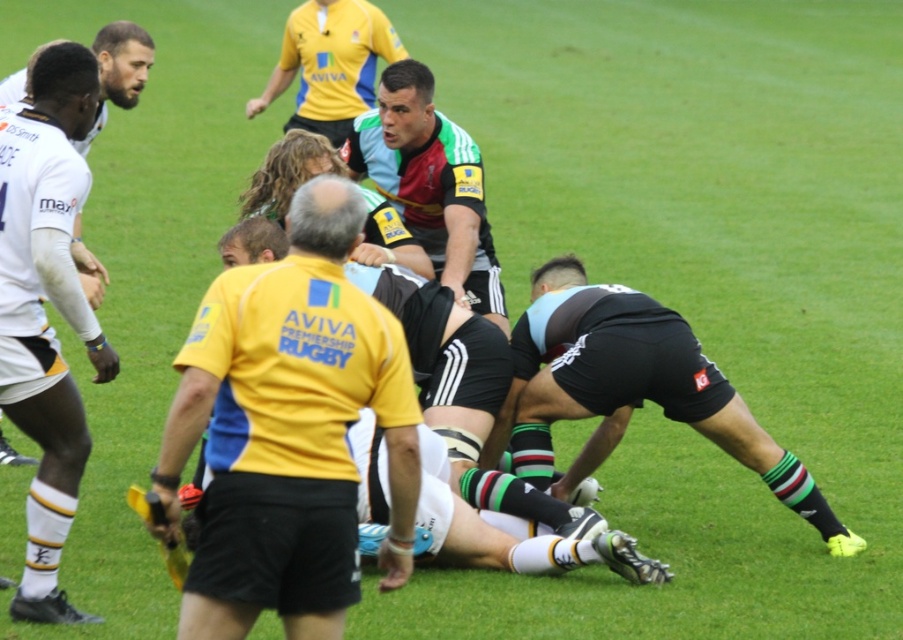
You are a spectator at the rugby match. You notice the yellow jersey at center and the white matte jersey at left. Which jersey is positioned lower in the image?

The yellow jersey at center is positioned lower than the white matte jersey at left.

You are a spectator at the rugby match and want to take a photo of the white matte jersey at left and the maroon jersey at center. Based on their positions, which jersey is closer to the ground?

The white matte jersey at left is located below the maroon jersey at center, so it is closer to the ground.